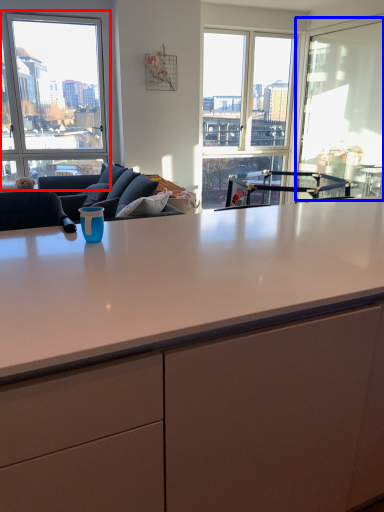
Question: Which object appears closest to the camera in this image, window (highlighted by a red box) or window screen (highlighted by a blue box)?

Choices:
 (A) window
 (B) window screen

Answer: (B)